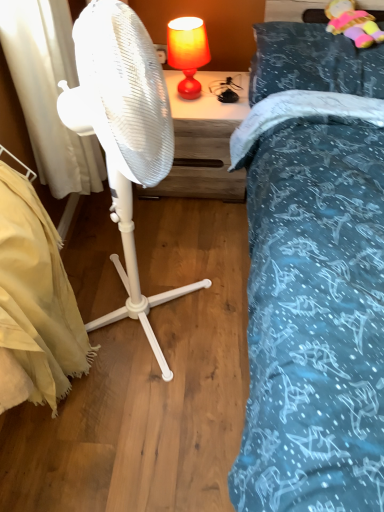
At what (x,y) coordinates should I click in order to perform the action: click on free point in front of white plastic fan at center. Please return your answer as a coordinate pair (x, y). This screenshot has height=512, width=384. Looking at the image, I should click on (149, 434).